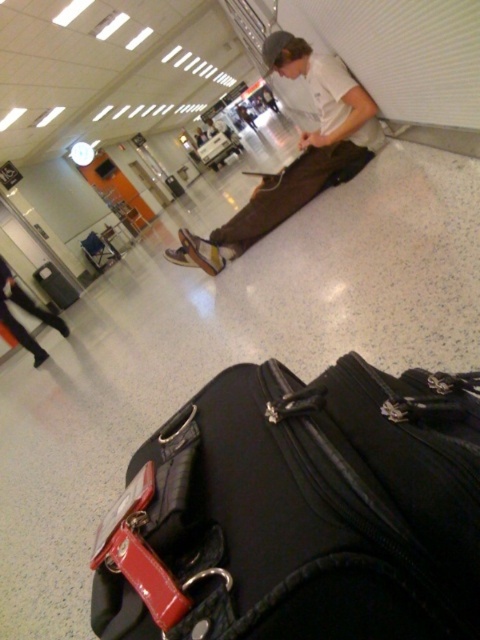
Does black fabric suitcase at lower center have a lesser height compared to brown canvas pants at center?

Yes.

Between black fabric suitcase at lower center and brown canvas pants at center, which one is positioned higher?

brown canvas pants at center is above.

The width and height of the screenshot is (480, 640). In order to click on black fabric suitcase at lower center in this screenshot , I will do pyautogui.click(x=300, y=512).

At what (x,y) coordinates should I click in order to perform the action: click on black fabric suitcase at lower center. Please return your answer as a coordinate pair (x, y). The width and height of the screenshot is (480, 640). Looking at the image, I should click on 300,512.